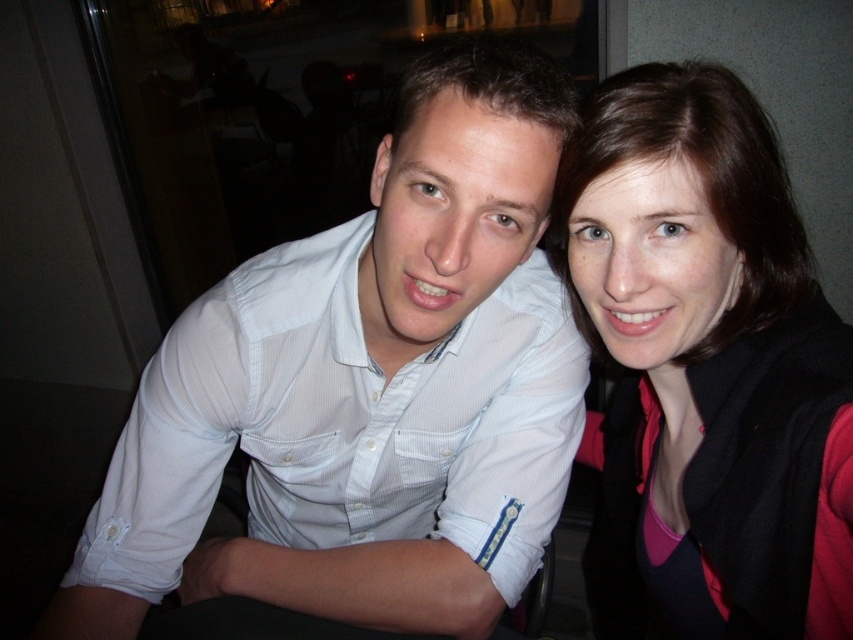
Question: Is white textured shirt at center smaller than matte black jacket at upper right?

Choices:
 (A) yes
 (B) no

Answer: (B)

Question: Which of the following is the closest to the observer?

Choices:
 (A) (647, 426)
 (B) (183, 520)

Answer: (B)

Question: Where is white textured shirt at center located in relation to matte black jacket at upper right in the image?

Choices:
 (A) below
 (B) above

Answer: (B)

Question: Which of the following is the closest to the observer?

Choices:
 (A) (796, 348)
 (B) (520, 433)

Answer: (A)

Question: Where is white textured shirt at center located in relation to matte black jacket at upper right in the image?

Choices:
 (A) below
 (B) above

Answer: (B)

Question: Which of the following is the closest to the observer?

Choices:
 (A) (834, 600)
 (B) (178, 547)

Answer: (A)